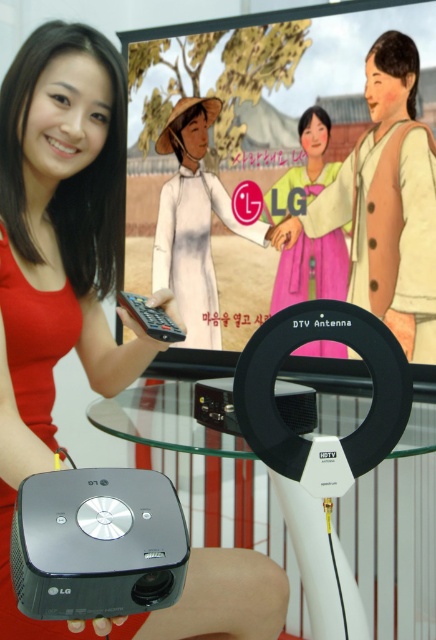
Question: Does pink fabric dress at center appear over black plastic antenna at center?

Choices:
 (A) no
 (B) yes

Answer: (B)

Question: Does black plastic projector at lower center appear on the right side of black plastic remote at center?

Choices:
 (A) yes
 (B) no

Answer: (A)

Question: Does matte red dress at center appear on the right side of matte white dress at center?

Choices:
 (A) no
 (B) yes

Answer: (A)

Question: Among these objects, which one is farthest from the camera?

Choices:
 (A) black plastic antenna at center
 (B) black plastic remote at center
 (C) black plastic projector at lower center

Answer: (A)

Question: Which point is farther to the camera?

Choices:
 (A) matte white dress at center
 (B) matte red dress at center
 (C) pink fabric dress at center
 (D) black plastic antenna at center

Answer: (A)

Question: Which of the following is the closest to the observer?

Choices:
 (A) (401, 278)
 (B) (302, 192)
 (C) (37, 616)

Answer: (C)